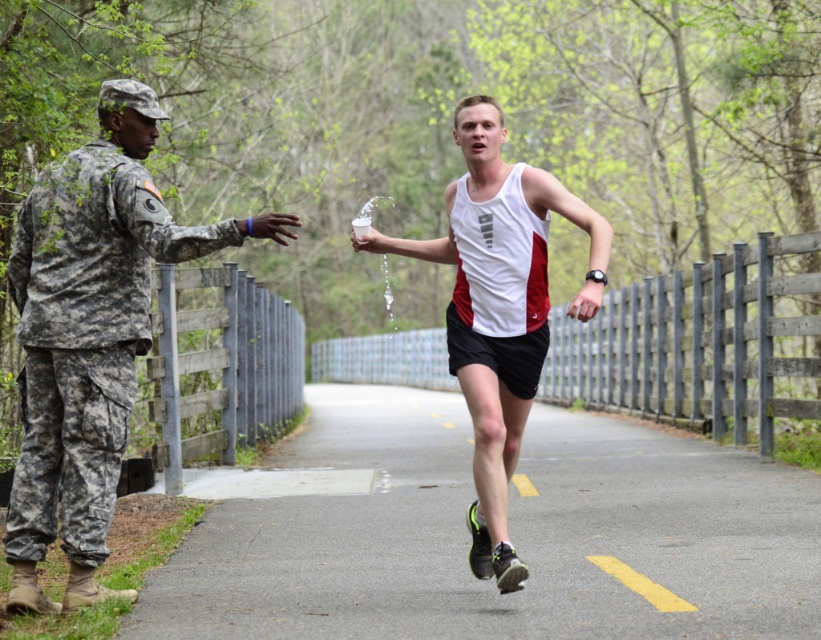
Is camouflage uniform at left taller than white matte tank top at center?

Yes, camouflage uniform at left is taller than white matte tank top at center.

Can you confirm if camouflage uniform at left is positioned above white matte tank top at center?

No, camouflage uniform at left is not above white matte tank top at center.

Locate an element on the screen. camouflage uniform at left is located at coordinates (90, 333).

Which is more to the right, black rubber shoe at center or white matte tank top at center?

From the viewer's perspective, black rubber shoe at center appears more on the right side.

Is black rubber shoe at center positioned in front of white matte tank top at center?

Yes, it is.

Does point (331, 419) come farther from viewer compared to point (530, 304)?

That is True.

Find the location of a particular element. The height and width of the screenshot is (640, 821). black rubber shoe at center is located at coordinates (510, 531).

Can you confirm if black rubber shoe at center is wider than camouflage uniform at left?

Correct, the width of black rubber shoe at center exceeds that of camouflage uniform at left.

Is point (537, 422) in front of point (58, 445)?

No, it is behind (58, 445).

Find the location of a particular element. Image resolution: width=821 pixels, height=640 pixels. black rubber shoe at center is located at coordinates (510, 531).